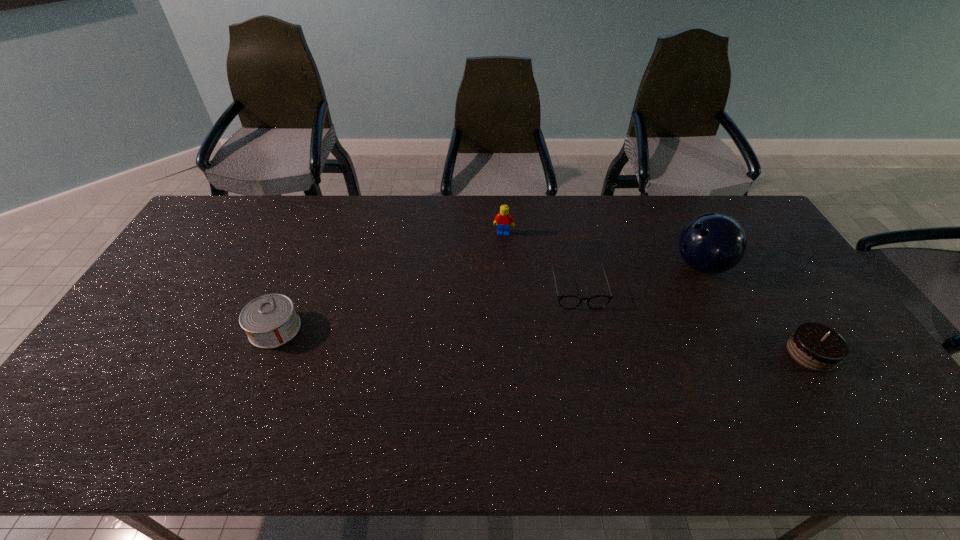
Where is `vacant region located on the face of the farthest object`? vacant region located on the face of the farthest object is located at coordinates (499, 246).

Image resolution: width=960 pixels, height=540 pixels. Identify the location of object located in the far edge section of the desktop. (503, 219).

Identify the location of object that is at the right edge. This screenshot has height=540, width=960. (814, 346).

Find the location of a particular element. free space at the far edge is located at coordinates (457, 235).

This screenshot has height=540, width=960. In the image, there is a desktop. In order to click on vacant region at the near edge in this screenshot , I will do `click(624, 407)`.

The width and height of the screenshot is (960, 540). In the image, there is a desktop. In order to click on vacant region at the right edge in this screenshot , I will do `click(784, 290)`.

This screenshot has height=540, width=960. In the image, there is a desktop. Find the location of `vacant space at the far left corner`. vacant space at the far left corner is located at coordinates click(204, 219).

You are a GUI agent. You are given a task and a screenshot of the screen. Output one action in this format:
    pyautogui.click(x=<x>, y=<y>)
    Task: Click on the vacant space that's between the leftmost object and the third object from left to right
    The height and width of the screenshot is (540, 960).
    Given the screenshot: What is the action you would take?
    pyautogui.click(x=426, y=308)

Locate an element on the screen. This screenshot has width=960, height=540. empty location between the can and the spectacles is located at coordinates (426, 308).

Identify the location of free space between the Lego and the rightmost object. This screenshot has height=540, width=960. (658, 293).